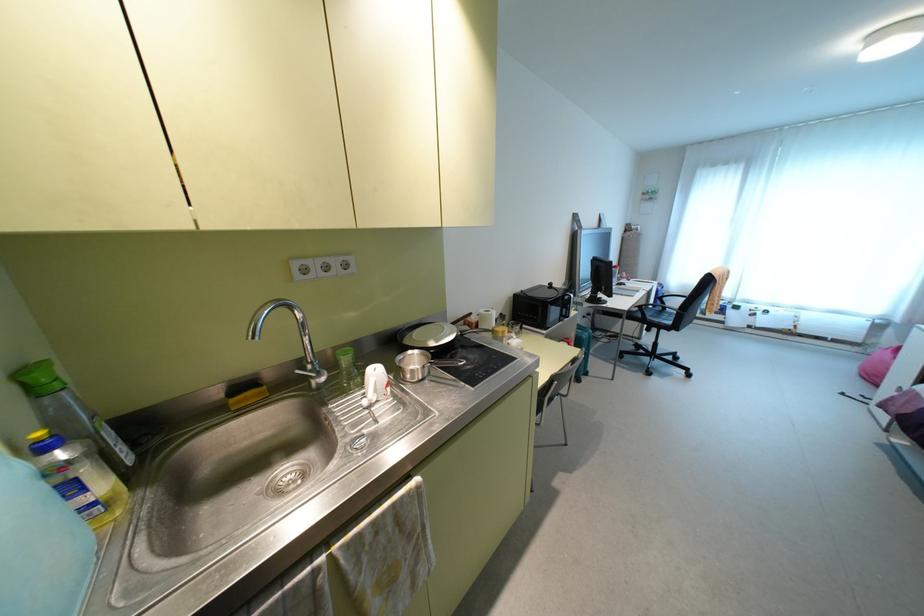
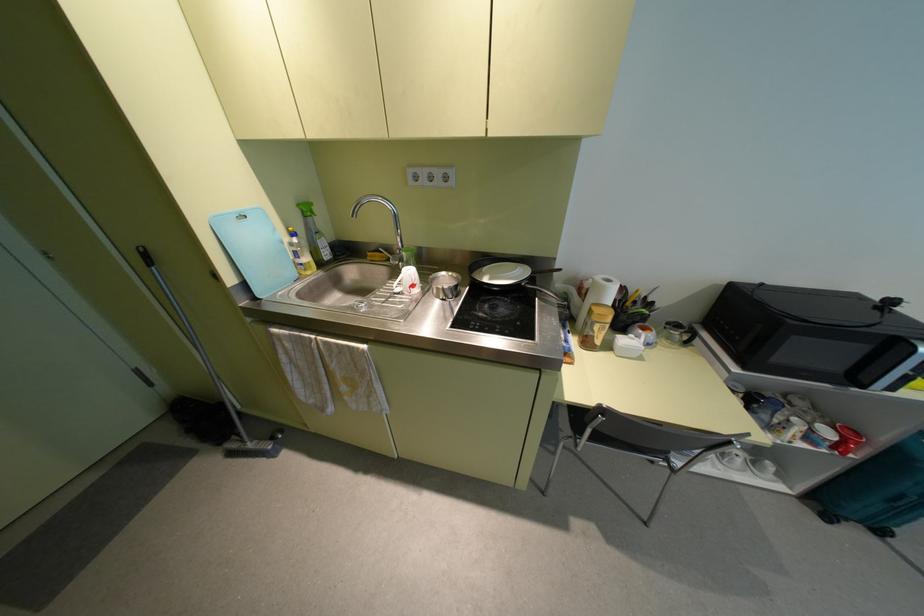
Locate, in the second image, the point that corresponds to point 43,447 in the first image.

(293, 233)